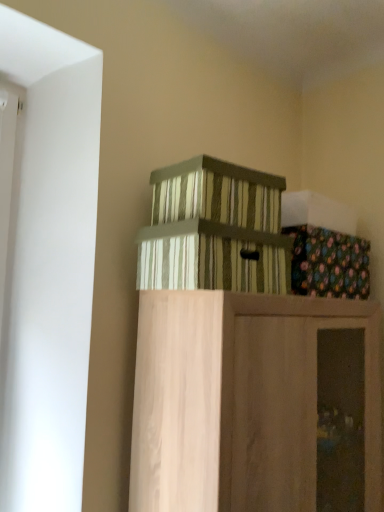
Question: Based on their sizes in the image, would you say striped cardboard crate at upper center, arranged as the 2th crate when ordered from the bottom, is bigger or smaller than wooden cabinet at upper center?

Choices:
 (A) big
 (B) small

Answer: (B)

Question: Relative to wooden cabinet at upper center, is striped cardboard crate at upper center, arranged as the 2th crate when ordered from the bottom, in front or behind?

Choices:
 (A) front
 (B) behind

Answer: (B)

Question: Which of these objects is positioned farthest from the floral fabric box at upper right?

Choices:
 (A) striped cardboard crate at upper center, positioned as the 1th crate in top-to-bottom order
 (B) striped cardboard box at center, which is the 2th crate from top to bottom
 (C) wooden cabinet at upper center

Answer: (C)

Question: Which object is the closest to the striped cardboard box at center, which is the 2th crate from top to bottom?

Choices:
 (A) striped cardboard crate at upper center, arranged as the 2th crate when ordered from the bottom
 (B) wooden cabinet at upper center
 (C) floral fabric box at upper right

Answer: (A)